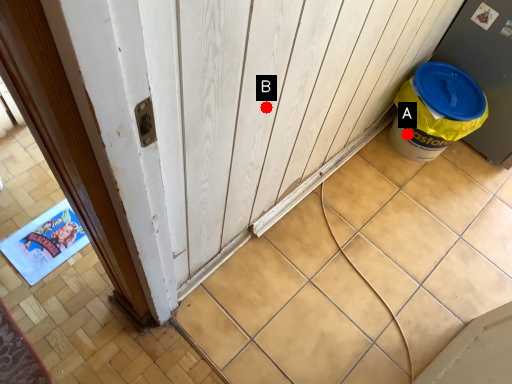
Question: Two points are circled on the image, labeled by A and B beside each circle. Which point is closer to the camera?

Choices:
 (A) A is closer
 (B) B is closer

Answer: (B)